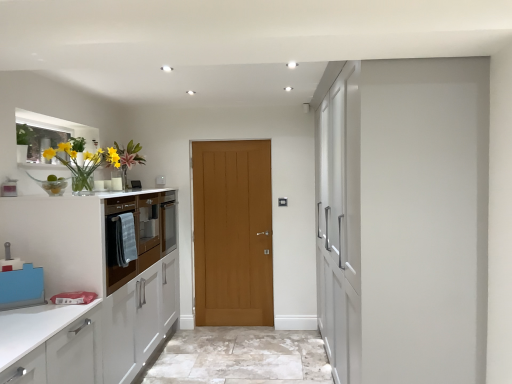
What do you see at coordinates (91, 286) in the screenshot? I see `white glossy cabinetry at left, acting as the 2th cabinetry starting from the back` at bounding box center [91, 286].

Find the location of a particular element. white glossy cabinetry at left, the 1th cabinetry from the front is located at coordinates (91, 286).

This screenshot has height=384, width=512. Find the location of `matte wood cabinet at left, the second cabinetry in the front-to-back sequence`. matte wood cabinet at left, the second cabinetry in the front-to-back sequence is located at coordinates (138, 234).

Considering the sizes of white glossy cabinetry at left, acting as the 2th cabinetry starting from the back, and wooden door at center in the image, is white glossy cabinetry at left, acting as the 2th cabinetry starting from the back, bigger or smaller than wooden door at center?

In the image, white glossy cabinetry at left, acting as the 2th cabinetry starting from the back, appears to be larger than wooden door at center.

Is wooden door at center at the back of white glossy cabinetry at left, acting as the 2th cabinetry starting from the back?

No, white glossy cabinetry at left, acting as the 2th cabinetry starting from the back, is not facing the opposite direction of wooden door at center.

Is point (119, 378) closer or farther from the camera than point (263, 262)?

Point (119, 378) is positioned closer to the camera compared to point (263, 262).

Would you say white glossy cabinetry at left, the 1th cabinetry from the front, is inside or outside wooden door at center?

white glossy cabinetry at left, the 1th cabinetry from the front, is outside wooden door at center.

Is there a large distance between wooden door at center and white glossy cabinetry at left, the 1th cabinetry from the front?

wooden door at center is positioned a significant distance from white glossy cabinetry at left, the 1th cabinetry from the front.

Starting from the wooden door at center, which cabinetry is the 2nd one to the left? Please provide its 2D coordinates.

[(91, 286)]

Is wooden door at center outside of white glossy cabinetry at left, acting as the 2th cabinetry starting from the back?

Absolutely, wooden door at center is external to white glossy cabinetry at left, acting as the 2th cabinetry starting from the back.

From a real-world perspective, is wooden door at center above or below white glossy cabinetry at left, acting as the 2th cabinetry starting from the back?

Clearly, from a real-world perspective, wooden door at center is below white glossy cabinetry at left, acting as the 2th cabinetry starting from the back.

Is wooden door at center located outside translucent glass vase at left?

Yes.

From their relative heights in the image, would you say wooden door at center is taller or shorter than translucent glass vase at left?

In the image, wooden door at center appears to be taller than translucent glass vase at left.

Is wooden door at center facing towards translucent glass vase at left?

Yes, wooden door at center is aimed at translucent glass vase at left.

In the scene shown: From the image's perspective, is translucent glass vase at left under wooden door at center?

Incorrect, from the image's perspective, translucent glass vase at left is higher than wooden door at center.

Could you tell me if translucent glass vase at left is turned towards wooden door at center?

No, translucent glass vase at left is not aimed at wooden door at center.

Would you say translucent glass vase at left is a long distance from wooden door at center?

Yes, translucent glass vase at left and wooden door at center are located far from each other.

At what (x,y) coordinates should I click in order to perform the action: click on door below the translucent glass vase at left (from a real-world perspective). Please return your answer as a coordinate pair (x, y). The image size is (512, 384). Looking at the image, I should click on (232, 233).

Is wooden door at center facing towards matte wood cabinet at left, which is the 1th cabinetry in back-to-front order?

No, wooden door at center is not facing towards matte wood cabinet at left, which is the 1th cabinetry in back-to-front order.

Can you confirm if wooden door at center is smaller than matte wood cabinet at left, the second cabinetry in the front-to-back sequence?

No, wooden door at center is not smaller than matte wood cabinet at left, the second cabinetry in the front-to-back sequence.

Does point (271, 292) lie in front of point (136, 264)?

No, (271, 292) is behind (136, 264).

Considering the relative positions of matte wood cabinet at left, which is the 1th cabinetry in back-to-front order, and wooden door at center in the image provided, is matte wood cabinet at left, which is the 1th cabinetry in back-to-front order, behind wooden door at center?

No, matte wood cabinet at left, which is the 1th cabinetry in back-to-front order, is closer to the viewer.

Which of these two, matte wood cabinet at left, the second cabinetry in the front-to-back sequence, or wooden door at center, is wider?

Wider between the two is matte wood cabinet at left, the second cabinetry in the front-to-back sequence.

From a real-world perspective, who is located higher, matte wood cabinet at left, the second cabinetry in the front-to-back sequence, or wooden door at center?

matte wood cabinet at left, the second cabinetry in the front-to-back sequence.

Is matte wood cabinet at left, which is the 1th cabinetry in back-to-front order, aimed at wooden door at center?

Yes.

In the scene shown: Considering the sizes of matte wood cabinet at left, which is the 1th cabinetry in back-to-front order, and translucent glass vase at left in the image, is matte wood cabinet at left, which is the 1th cabinetry in back-to-front order, taller or shorter than translucent glass vase at left?

Clearly, matte wood cabinet at left, which is the 1th cabinetry in back-to-front order, is taller compared to translucent glass vase at left.

Measure the distance from matte wood cabinet at left, which is the 1th cabinetry in back-to-front order, to translucent glass vase at left.

They are 53.16 centimeters apart.

Is matte wood cabinet at left, which is the 1th cabinetry in back-to-front order, far away from translucent glass vase at left?

No, there isn't a large distance between matte wood cabinet at left, which is the 1th cabinetry in back-to-front order, and translucent glass vase at left.

Which cabinetry is the 2nd one when counting from the front of the wooden door at center? Please provide its 2D coordinates.

[(91, 286)]

From the image's perspective, which cabinetry is the 1st one above the wooden door at center? Please provide its 2D coordinates.

[(91, 286)]

When comparing their distances from translucent glass vase at left, does white glossy cabinetry at left, the 1th cabinetry from the front, or wooden door at center seem closer?

The object closer to translucent glass vase at left is white glossy cabinetry at left, the 1th cabinetry from the front.

When comparing their distances from translucent glass vase at left, does matte wood cabinet at left, the second cabinetry in the front-to-back sequence, or white glossy cabinetry at left, acting as the 2th cabinetry starting from the back, seem further?

Among the two, white glossy cabinetry at left, acting as the 2th cabinetry starting from the back, is located further to translucent glass vase at left.

Considering their positions, is white glossy cabinetry at left, acting as the 2th cabinetry starting from the back, positioned closer to translucent glass vase at left than matte wood cabinet at left, which is the 1th cabinetry in back-to-front order?

matte wood cabinet at left, which is the 1th cabinetry in back-to-front order, is closer to translucent glass vase at left.

From the image, which object appears to be nearer to matte wood cabinet at left, the second cabinetry in the front-to-back sequence, translucent glass vase at left or white glossy cabinetry at left, the 1th cabinetry from the front?

Among the two, white glossy cabinetry at left, the 1th cabinetry from the front, is located nearer to matte wood cabinet at left, the second cabinetry in the front-to-back sequence.

Considering their positions, is wooden door at center positioned closer to white glossy cabinetry at left, the 1th cabinetry from the front, than translucent glass vase at left?

translucent glass vase at left is closer to white glossy cabinetry at left, the 1th cabinetry from the front.

From the picture: When comparing their distances from matte wood cabinet at left, the second cabinetry in the front-to-back sequence, does wooden door at center or translucent glass vase at left seem further?

wooden door at center lies further to matte wood cabinet at left, the second cabinetry in the front-to-back sequence, than the other object.

Estimate the real-world distances between objects in this image. Which object is further from white glossy cabinetry at left, the 1th cabinetry from the front, translucent glass vase at left or wooden door at center?

Based on the image, wooden door at center appears to be further to white glossy cabinetry at left, the 1th cabinetry from the front.

Based on their spatial positions, is wooden door at center or matte wood cabinet at left, the second cabinetry in the front-to-back sequence, closer to translucent glass vase at left?

matte wood cabinet at left, the second cabinetry in the front-to-back sequence, is closer to translucent glass vase at left.

The width and height of the screenshot is (512, 384). Identify the location of cabinetry located between white glossy cabinetry at left, acting as the 2th cabinetry starting from the back, and wooden door at center in the depth direction. (138, 234).

Locate an element on the screen. cabinetry between translucent glass vase at left and matte wood cabinet at left, which is the 1th cabinetry in back-to-front order, along the z-axis is located at coordinates (91, 286).